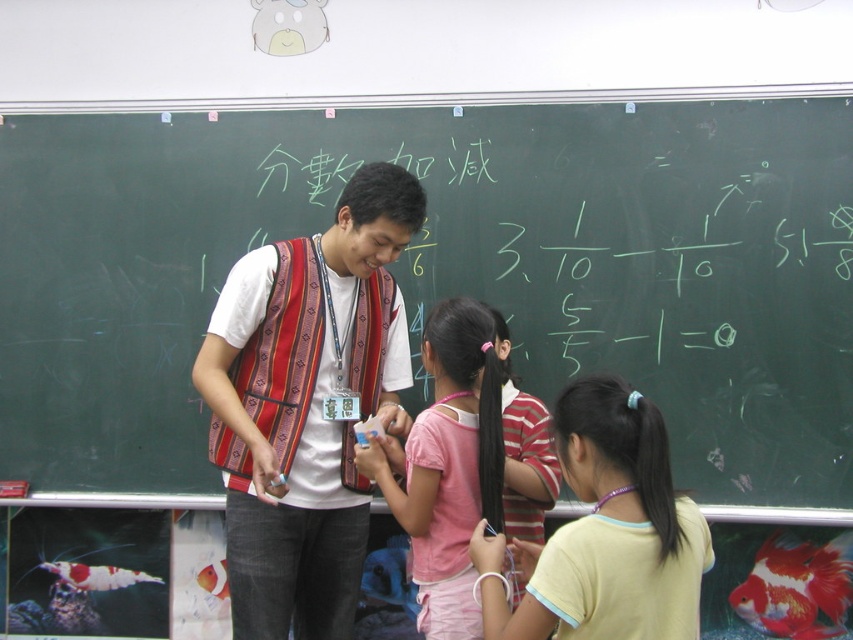
Who is positioned more to the left, green chalkboard at center or striped fabric vest at center?

Positioned to the left is striped fabric vest at center.

Is green chalkboard at center to the right of striped fabric vest at center from the viewer's perspective?

Yes, green chalkboard at center is to the right of striped fabric vest at center.

Identify the location of green chalkboard at center. This screenshot has height=640, width=853. (445, 269).

Between striped fabric vest at center and yellow cotton shirt at lower right, which one is positioned higher?

striped fabric vest at center is higher up.

Between point (339, 554) and point (619, 595), which one is positioned behind?

The point (339, 554) is behind.

At what (x,y) coordinates should I click in order to perform the action: click on striped fabric vest at center. Please return your answer as a coordinate pair (x, y). Looking at the image, I should click on (306, 404).

Can you confirm if striped fabric vest at center is positioned above pink fabric shirt at center?

Yes.

Does striped fabric vest at center appear on the right side of pink fabric shirt at center?

Incorrect, striped fabric vest at center is not on the right side of pink fabric shirt at center.

Measure the distance between striped fabric vest at center and camera.

A distance of 7.26 feet exists between striped fabric vest at center and camera.

Where is `striped fabric vest at center`? Image resolution: width=853 pixels, height=640 pixels. striped fabric vest at center is located at coordinates (306, 404).